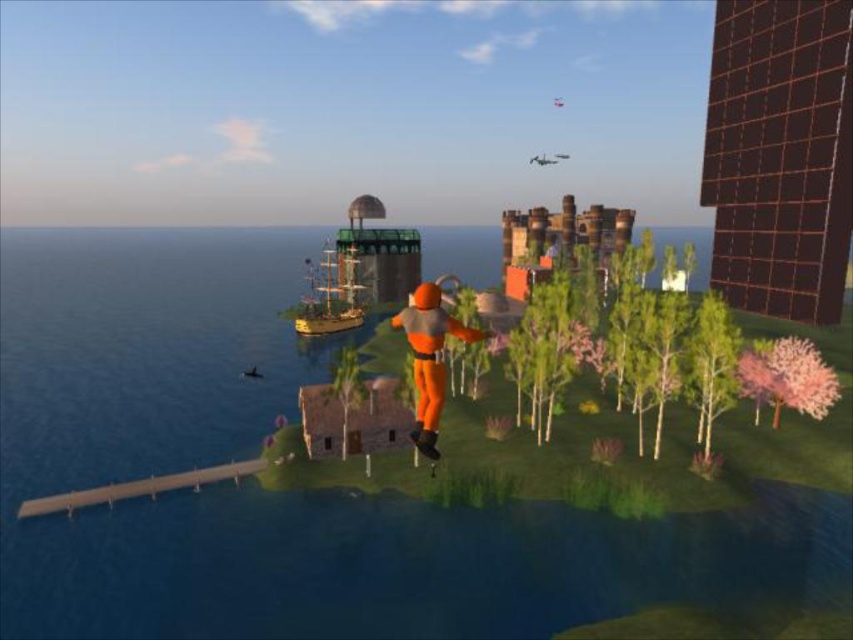
Question: Estimate the real-world distances between objects in this image. Which object is farther from the transparent blue water at center?

Choices:
 (A) pink fluffy tree at lower right
 (B) green matte tree at lower right
 (C) orange matte jumpsuit at center
 (D) green matte tree at center

Answer: (D)

Question: In this image, where is transparent blue water at center located relative to green matte tree at center?

Choices:
 (A) left
 (B) right

Answer: (A)

Question: Can you confirm if orange matte jumpsuit at center is positioned above green matte tree at lower right?

Choices:
 (A) no
 (B) yes

Answer: (B)

Question: Can you confirm if pink fluffy tree at lower right is positioned below green matte tree at center?

Choices:
 (A) no
 (B) yes

Answer: (A)

Question: Based on their relative distances, which object is nearer to the transparent blue water at center?

Choices:
 (A) pink fluffy tree at lower right
 (B) orange matte jumpsuit at center

Answer: (A)

Question: Which of these objects is positioned closest to the green matte tree at center?

Choices:
 (A) green matte tree at lower right
 (B) pink fluffy tree at lower right
 (C) orange matte jumpsuit at center

Answer: (C)